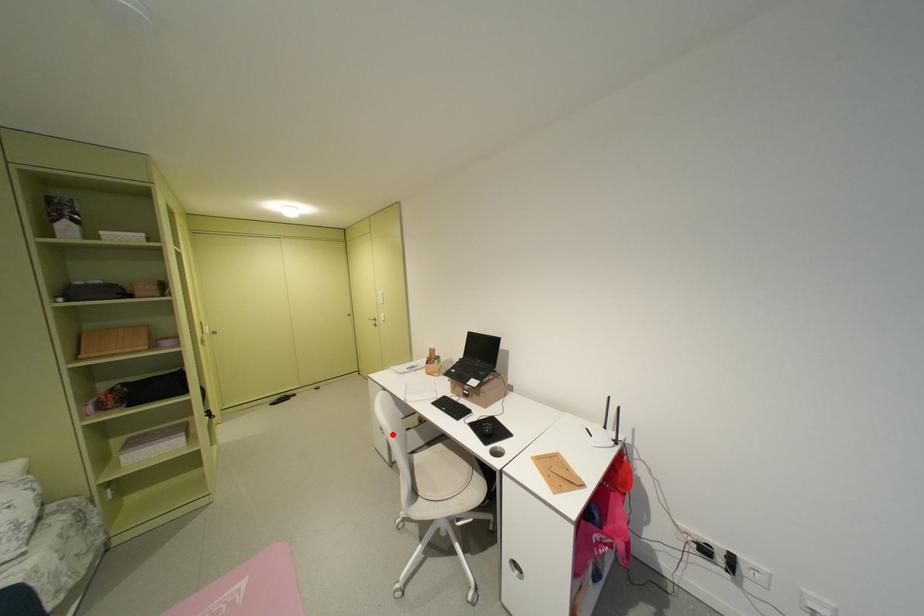
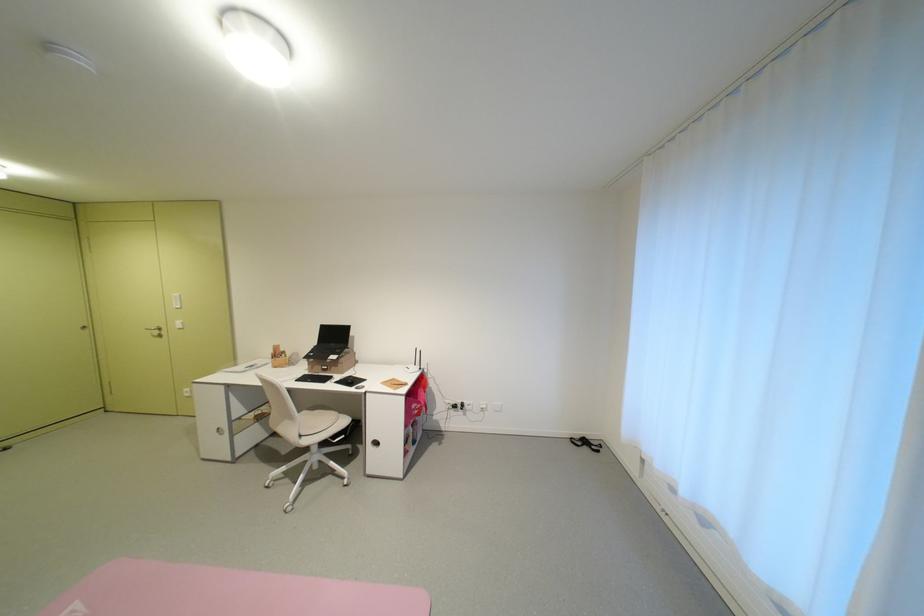
Locate, in the second image, the point that corresponds to the highlighted location in the first image.

(232, 435)